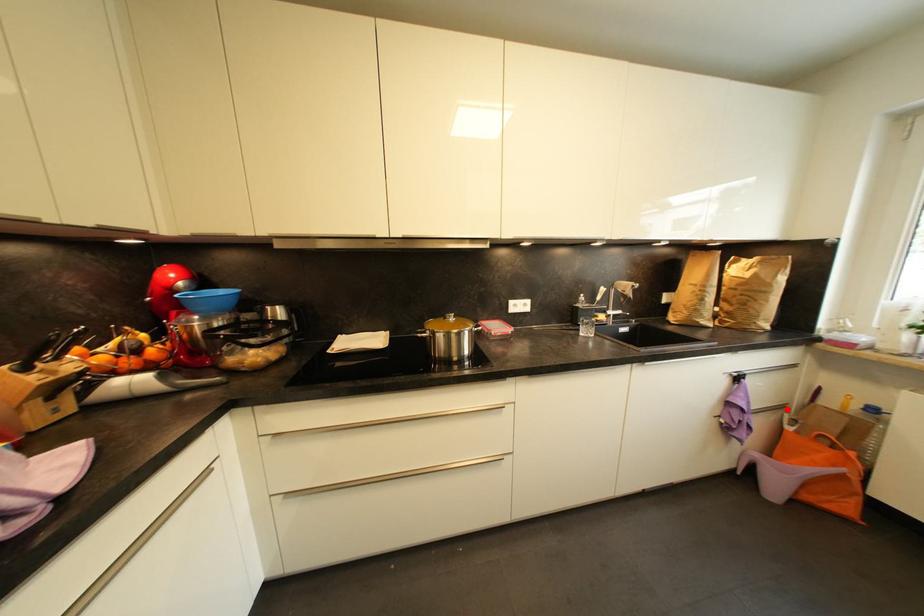
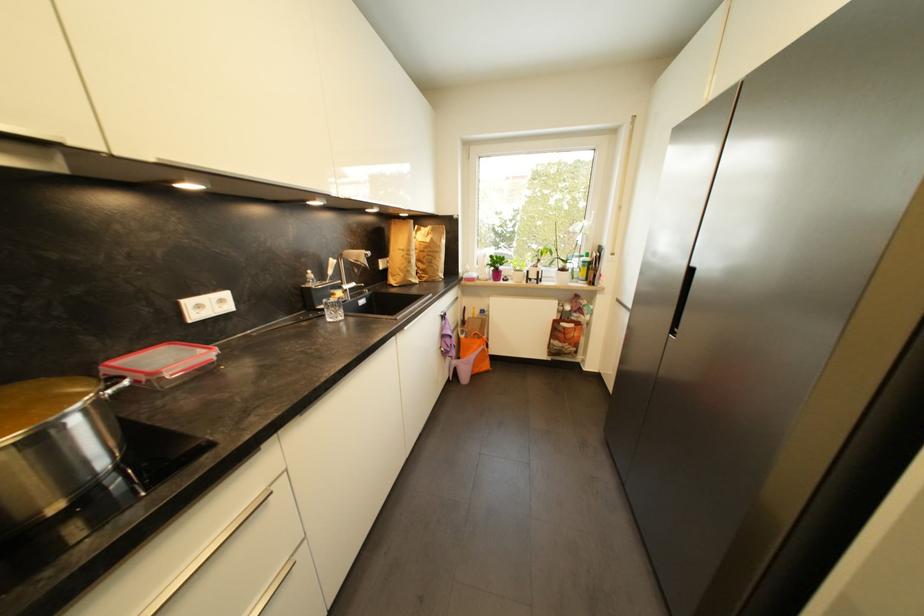
Question: I am providing you with two images of the same scene from different viewpoints. Given a red point in image1, look at the same physical point in image2. Is it:

Choices:
 (A) Closer to the viewpoint
 (B) Farther from the viewpoint

Answer: (A)